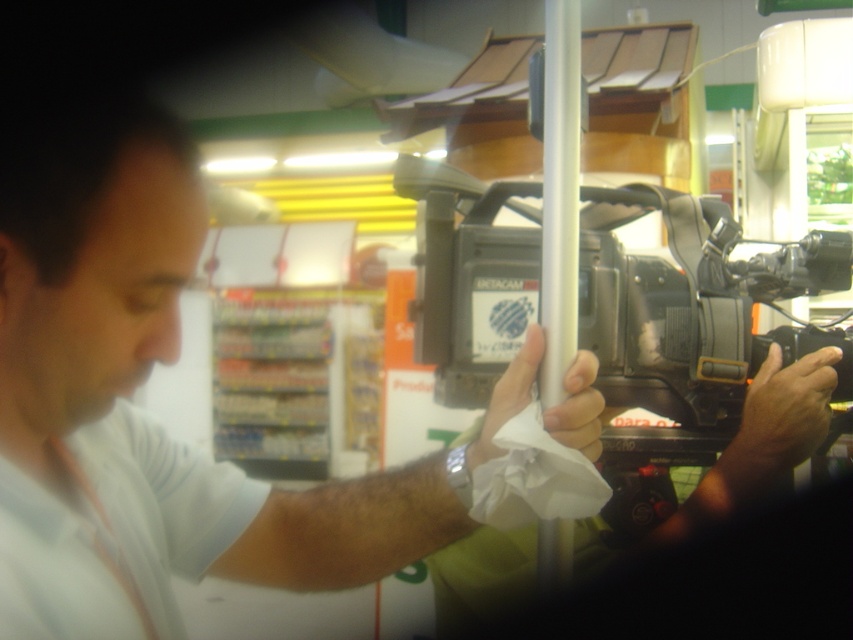
Is black plastic video camera at center in front of smooth skin hand at center?

Yes, black plastic video camera at center is in front of smooth skin hand at center.

Where is `black plastic video camera at center`? black plastic video camera at center is located at coordinates (693, 316).

Between white plastic pole at center and white matte paper towel at center, which one has less height?

white matte paper towel at center

You are a GUI agent. You are given a task and a screenshot of the screen. Output one action in this format:
    pyautogui.click(x=<x>, y=<y>)
    Task: Click on the white plastic pole at center
    The width and height of the screenshot is (853, 640).
    Given the screenshot: What is the action you would take?
    pyautogui.click(x=558, y=189)

Is white plastic pole at center to the right of smooth skin hand at center from the viewer's perspective?

No, white plastic pole at center is not to the right of smooth skin hand at center.

What do you see at coordinates (558, 189) in the screenshot? This screenshot has height=640, width=853. I see `white plastic pole at center` at bounding box center [558, 189].

Where is `white plastic pole at center`? This screenshot has width=853, height=640. white plastic pole at center is located at coordinates (558, 189).